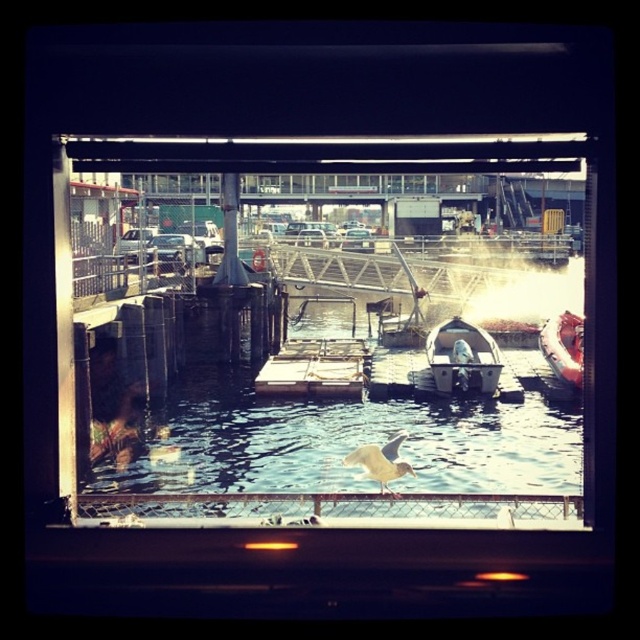
You are an interior designer planning to place a decorative boat model on a windowsill. The transparent glass window at center has a width of 1 meter. If the white plastic boat at center is 30 cm long, will it fit on the windowsill without overlapping the window frame?

The transparent glass window at center is larger in size than the white plastic boat at center. Since the window is 1 meter wide and the boat is only 30 cm long, the white plastic boat at center will fit comfortably on the windowsill without overlapping the window frame.

You are standing on the white plastic dock at center and want to reach the rubberized red boat at right. According to the scene, is the boat located above or below the dock?

The white plastic dock at center is positioned under the rubberized red boat at right, so the boat is above the dock.